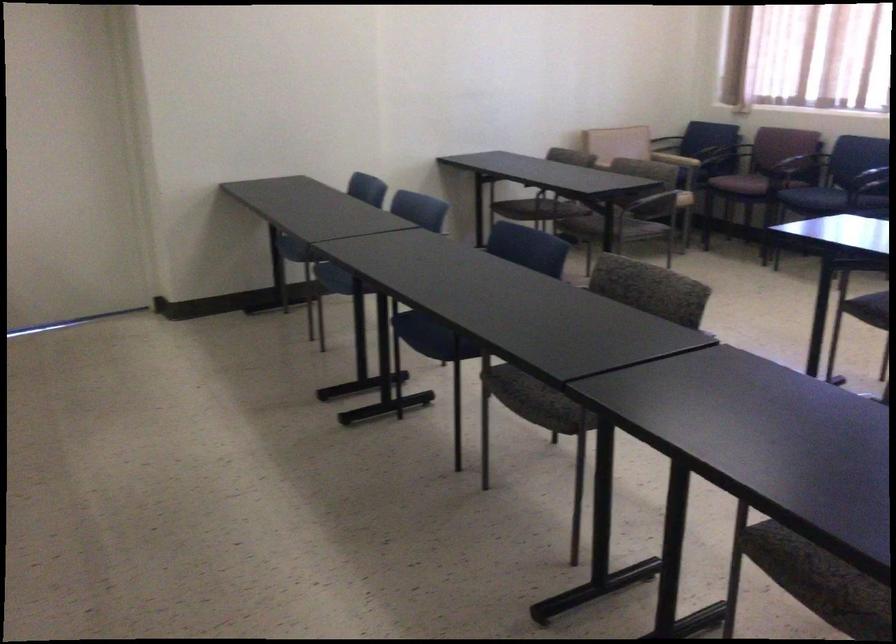
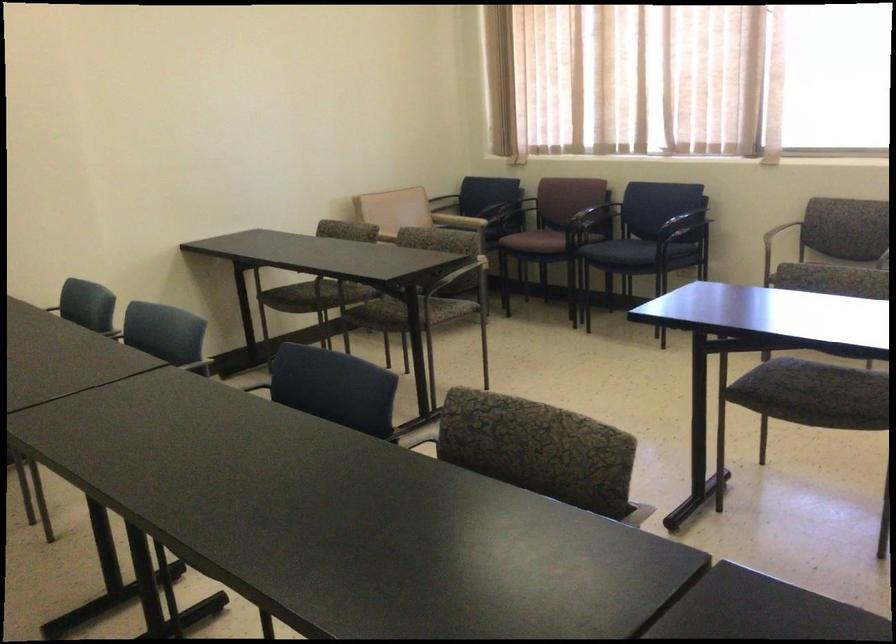
Question: Based on the continuous images, in which direction is the camera rotating? Reply with the corresponding letter.

Choices:
 (A) Left
 (B) Right
 (C) Up
 (D) Down

Answer: (B)